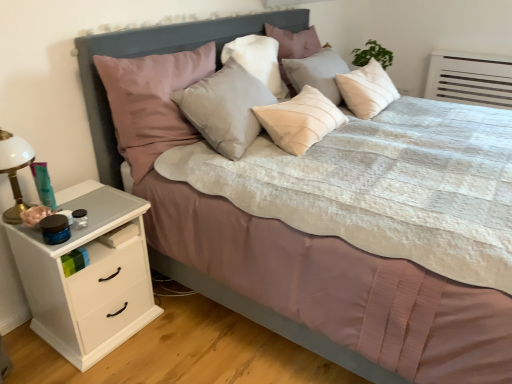
Question: Is velvet pink pillow at upper left, arranged as the 1th pillow when viewed from the left, in contact with white matte chest of drawers at left?

Choices:
 (A) no
 (B) yes

Answer: (A)

Question: Does velvet pink pillow at upper left, arranged as the 1th pillow when viewed from the left, have a greater width compared to white matte chest of drawers at left?

Choices:
 (A) yes
 (B) no

Answer: (B)

Question: Can white matte chest of drawers at left be found inside velvet pink pillow at upper left, the third pillow positioned from the right?

Choices:
 (A) no
 (B) yes

Answer: (A)

Question: Is velvet pink pillow at upper left, the third pillow positioned from the right, further to the viewer compared to white matte chest of drawers at left?

Choices:
 (A) no
 (B) yes

Answer: (B)

Question: From a real-world perspective, is velvet pink pillow at upper left, arranged as the 1th pillow when viewed from the left, physically above white matte chest of drawers at left?

Choices:
 (A) yes
 (B) no

Answer: (A)

Question: Relative to light beige fabric pillow at center, which appears as the 3th pillow when viewed from the left, is matte gray pillow at center, the second pillow when ordered from right to left, in front or behind?

Choices:
 (A) front
 (B) behind

Answer: (A)

Question: Is matte gray pillow at center, the second pillow when ordered from right to left, inside or outside of light beige fabric pillow at center, which ranks as the 1th pillow in right-to-left order?

Choices:
 (A) inside
 (B) outside

Answer: (B)

Question: In terms of size, does matte gray pillow at center, the second pillow when ordered from right to left, appear bigger or smaller than light beige fabric pillow at center, which ranks as the 1th pillow in right-to-left order?

Choices:
 (A) big
 (B) small

Answer: (B)

Question: Visually, is matte gray pillow at center, which appears as the 2th pillow when viewed from the left, positioned to the left or to the right of light beige fabric pillow at center, which ranks as the 1th pillow in right-to-left order?

Choices:
 (A) left
 (B) right

Answer: (A)

Question: From their relative heights in the image, would you say matte gray headboard at center is taller or shorter than light beige fabric pillow at center, which ranks as the 1th pillow in right-to-left order?

Choices:
 (A) short
 (B) tall

Answer: (B)

Question: Based on their sizes in the image, would you say matte gray headboard at center is bigger or smaller than light beige fabric pillow at center, which appears as the 3th pillow when viewed from the left?

Choices:
 (A) big
 (B) small

Answer: (A)

Question: Is point (99, 46) positioned closer to the camera than point (314, 34)?

Choices:
 (A) farther
 (B) closer

Answer: (B)

Question: Is matte gray headboard at center to the left or to the right of light beige fabric pillow at center, which appears as the 3th pillow when viewed from the left, in the image?

Choices:
 (A) left
 (B) right

Answer: (A)

Question: From the image's perspective, is white glass lamp at left above or below velvet pink pillow at upper left, the third pillow positioned from the right?

Choices:
 (A) below
 (B) above

Answer: (A)

Question: Is white glass lamp at left inside or outside of velvet pink pillow at upper left, arranged as the 1th pillow when viewed from the left?

Choices:
 (A) inside
 (B) outside

Answer: (B)